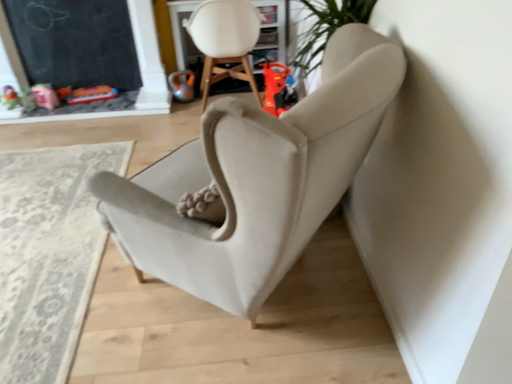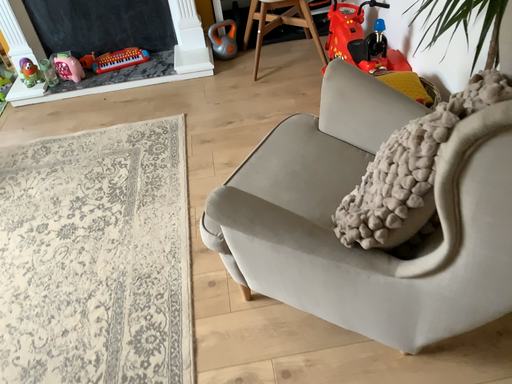
Question: How did the camera likely rotate when shooting the video?

Choices:
 (A) rotated upward
 (B) rotated downward

Answer: (B)